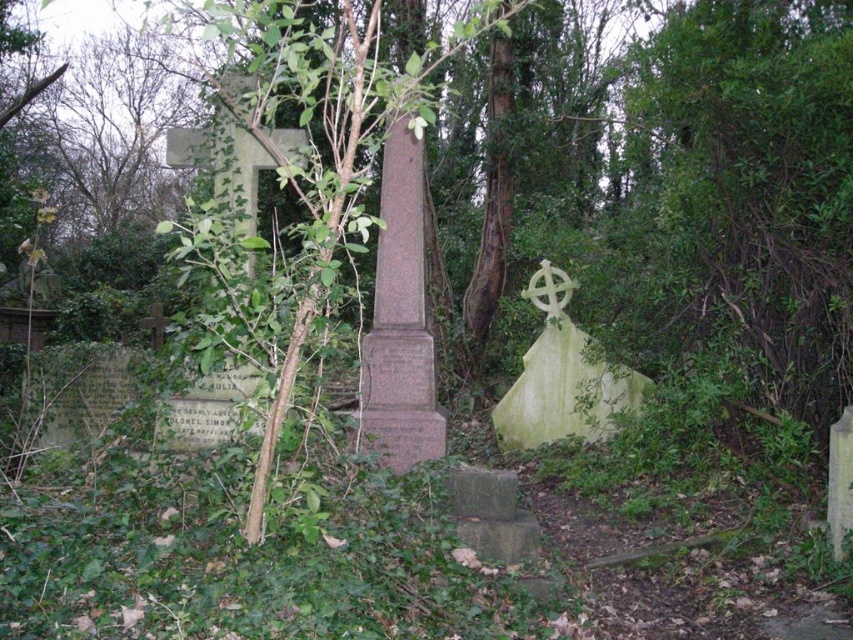
Is point (241, 20) positioned after point (544, 291)?

No.

Between green leafy tree at center and white stone cross at center right, which one has less height?

white stone cross at center right

The image size is (853, 640). I want to click on green leafy tree at center, so click(x=322, y=124).

Where is `green leafy tree at center`? Image resolution: width=853 pixels, height=640 pixels. green leafy tree at center is located at coordinates (322, 124).